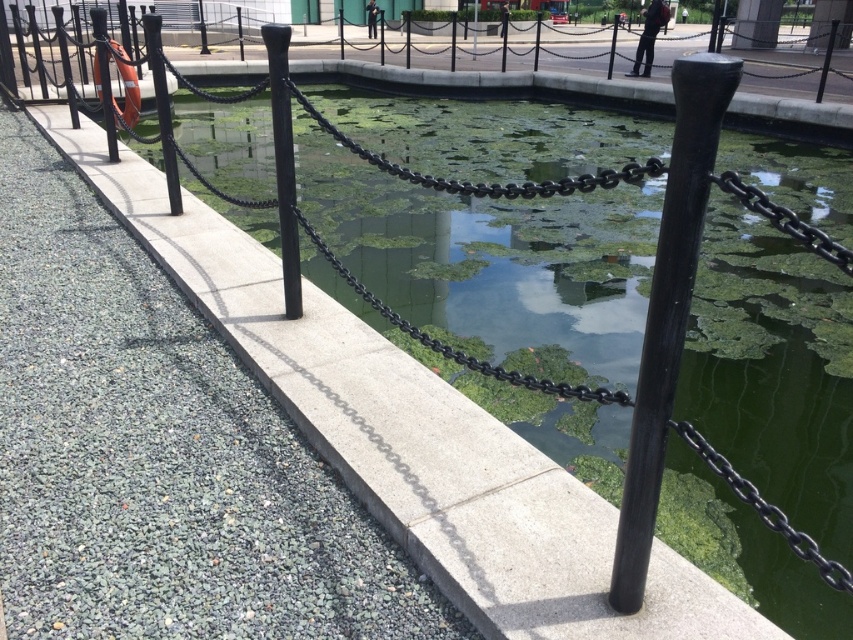
From the picture: Can you confirm if black matte pole at center is bigger than black metal fence at upper center?

No, black matte pole at center is not bigger than black metal fence at upper center.

Locate an element on the screen. This screenshot has height=640, width=853. black matte pole at center is located at coordinates (668, 308).

Who is positioned more to the left, black matte pole at center or black polished metal pole at center?

Positioned to the left is black polished metal pole at center.

Is point (630, 580) positioned after point (283, 196)?

No.

Where is `black matte pole at center`? The image size is (853, 640). black matte pole at center is located at coordinates (668, 308).

Does black polished metal pole at center come in front of black metal pole at left?

Yes, it is.

How much distance is there between black polished metal pole at center and black metal pole at left?

black polished metal pole at center is 3.87 meters away from black metal pole at left.

What do you see at coordinates (283, 163) in the screenshot?
I see `black polished metal pole at center` at bounding box center [283, 163].

You are a GUI agent. You are given a task and a screenshot of the screen. Output one action in this format:
    pyautogui.click(x=<x>, y=<y>)
    Task: Click on the black polished metal pole at center
    Image resolution: width=853 pixels, height=640 pixels.
    Given the screenshot: What is the action you would take?
    pyautogui.click(x=283, y=163)